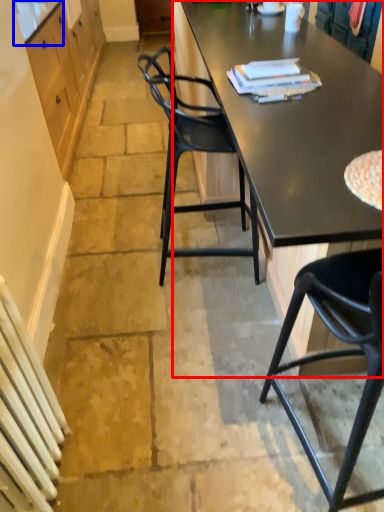
Question: Which of the following is the closest to the observer, desk (highlighted by a red box) or counter top (highlighted by a blue box)?

Choices:
 (A) desk
 (B) counter top

Answer: (A)